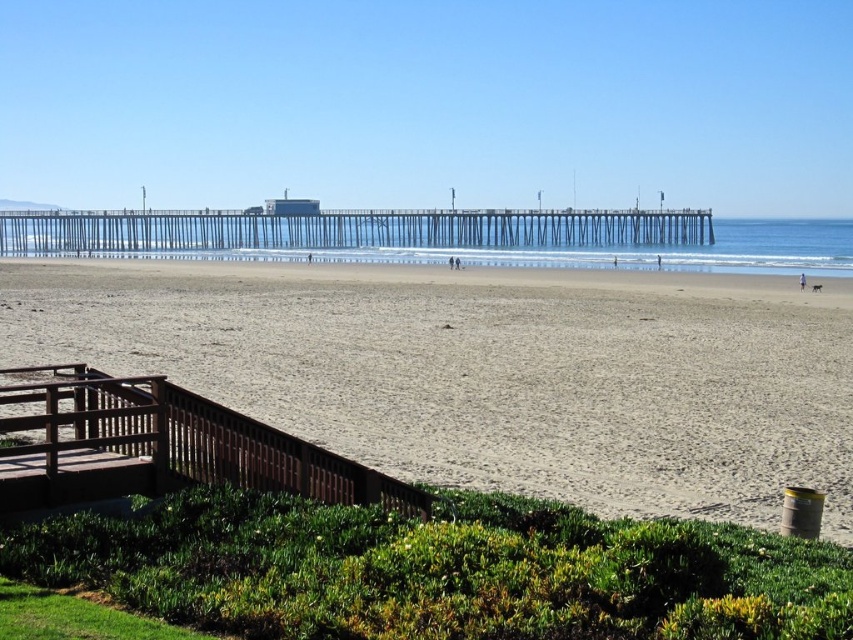
Find the location of `light brown sand at center`. light brown sand at center is located at coordinates (489, 371).

Does light brown sand at center have a greater width compared to brown wooden stairs at lower left?

Yes.

Describe the element at coordinates (489, 371) in the screenshot. I see `light brown sand at center` at that location.

You are a GUI agent. You are given a task and a screenshot of the screen. Output one action in this format:
    pyautogui.click(x=<x>, y=<y>)
    Task: Click on the light brown sand at center
    The image size is (853, 640).
    Given the screenshot: What is the action you would take?
    pyautogui.click(x=489, y=371)

Can you confirm if light brown sand at center is shorter than metallic gray pier at center?

Correct, light brown sand at center is not as tall as metallic gray pier at center.

Can you confirm if light brown sand at center is thinner than metallic gray pier at center?

Yes, light brown sand at center is thinner than metallic gray pier at center.

Is point (575, 292) farther from viewer compared to point (575, 218)?

No, it is not.

Locate an element on the screen. The width and height of the screenshot is (853, 640). light brown sand at center is located at coordinates (489, 371).

Is brown wooden stairs at lower left to the left of metallic gray pier at center from the viewer's perspective?

In fact, brown wooden stairs at lower left is to the right of metallic gray pier at center.

Image resolution: width=853 pixels, height=640 pixels. What are the coordinates of `brown wooden stairs at lower left` in the screenshot? It's located at (160, 445).

At what (x,y) coordinates should I click in order to perform the action: click on brown wooden stairs at lower left. Please return your answer as a coordinate pair (x, y). The width and height of the screenshot is (853, 640). Looking at the image, I should click on (160, 445).